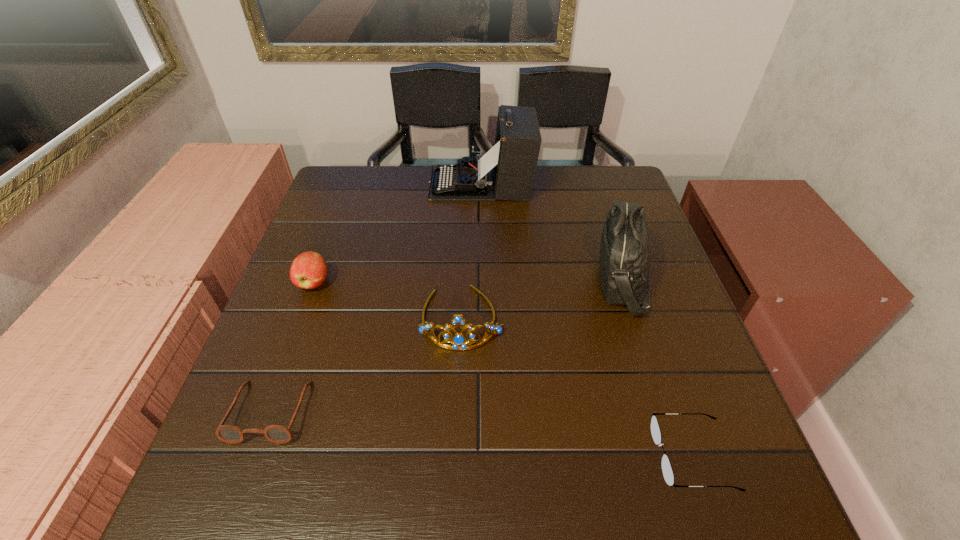
In order to click on free space located at the front padded panel of the shoulder bag in this screenshot , I will do `click(541, 280)`.

Find the location of a particular element. Image resolution: width=960 pixels, height=540 pixels. free region located at the front padded panel of the shoulder bag is located at coordinates (492, 280).

Image resolution: width=960 pixels, height=540 pixels. I want to click on vacant space located at the front padded panel of the shoulder bag, so click(434, 280).

I want to click on vacant area situated on the front-facing side of the tiara, so click(457, 411).

The image size is (960, 540). I want to click on vacant space located 0.370m on the front of the fourth tallest object, so click(251, 451).

Identify the location of vacant space located on the front-facing side of the left spectacles. The width and height of the screenshot is (960, 540). (248, 474).

The height and width of the screenshot is (540, 960). Find the location of `free location located 0.240m on the lenses of the right spectacles`. free location located 0.240m on the lenses of the right spectacles is located at coordinates (517, 456).

At what (x,y) coordinates should I click in order to perform the action: click on vacant region located on the lenses of the right spectacles. Please return your answer as a coordinate pair (x, y). This screenshot has width=960, height=540. Looking at the image, I should click on (605, 456).

Find the location of `free space located 0.190m on the lenses of the right spectacles`. free space located 0.190m on the lenses of the right spectacles is located at coordinates click(x=546, y=456).

The image size is (960, 540). I want to click on object that is at the far edge, so click(x=506, y=172).